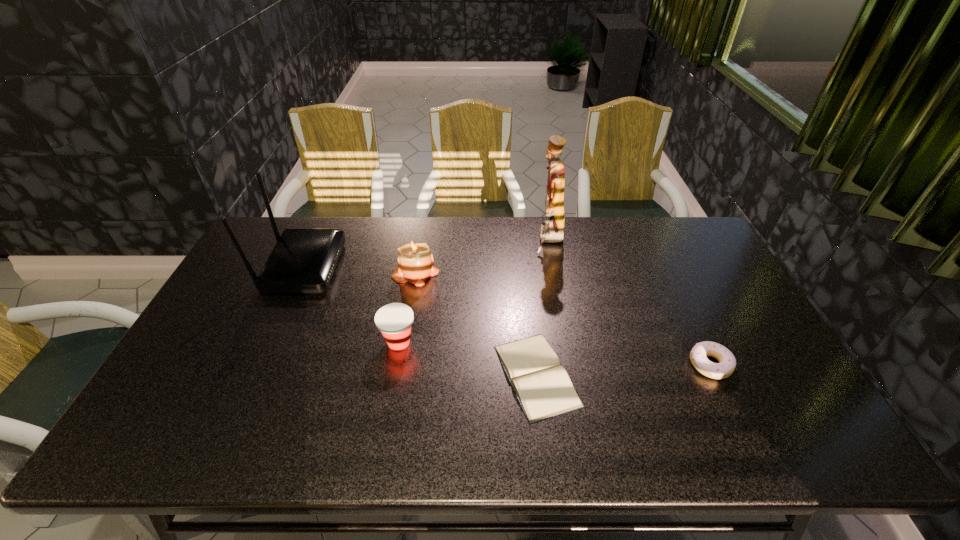
At what (x,y) coordinates should I click in order to perform the action: click on object present at the right edge. Please return your answer as a coordinate pair (x, y). Image resolution: width=960 pixels, height=540 pixels. Looking at the image, I should click on (727, 363).

Identify the location of object positioned at the far left corner. The image size is (960, 540). (303, 260).

At what (x,y) coordinates should I click in order to perform the action: click on free space at the far edge of the desktop. Please return your answer as a coordinate pair (x, y). This screenshot has height=540, width=960. Looking at the image, I should click on (657, 254).

This screenshot has width=960, height=540. I want to click on vacant area at the near edge, so click(445, 440).

Image resolution: width=960 pixels, height=540 pixels. I want to click on vacant space at the left edge of the desktop, so click(182, 391).

In the image, there is a desktop. Where is `vacant area at the right edge`? This screenshot has height=540, width=960. vacant area at the right edge is located at coordinates (755, 340).

Find the location of `blank space at the near left corner of the desktop`. blank space at the near left corner of the desktop is located at coordinates (190, 455).

Identify the location of empty location between the candle and the nutcracker. [x=483, y=256].

Identify the location of empty location between the Dixie cup and the shortest object. This screenshot has width=960, height=540. (468, 359).

Find the location of a particular element. The height and width of the screenshot is (540, 960). free point between the second shortest object and the tallest object is located at coordinates (630, 302).